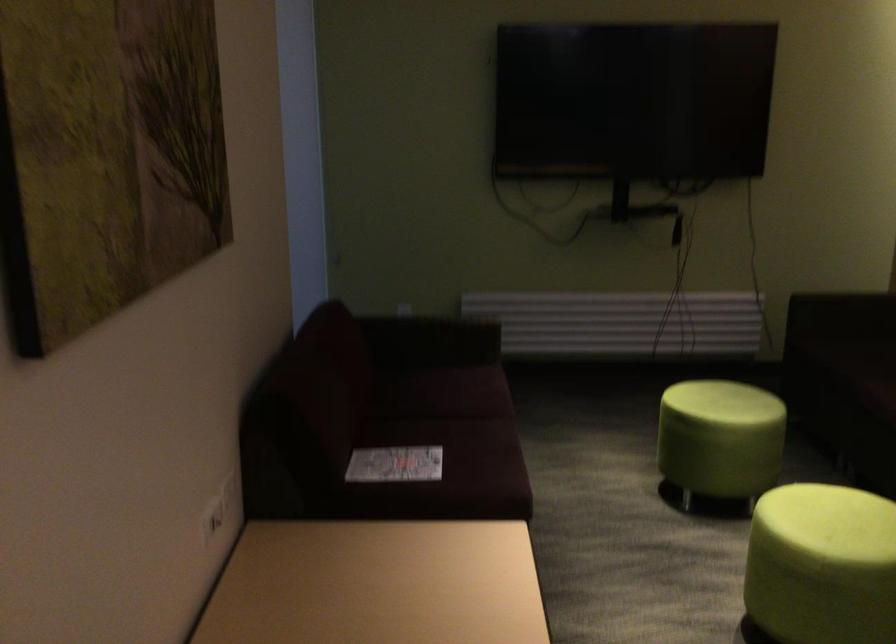
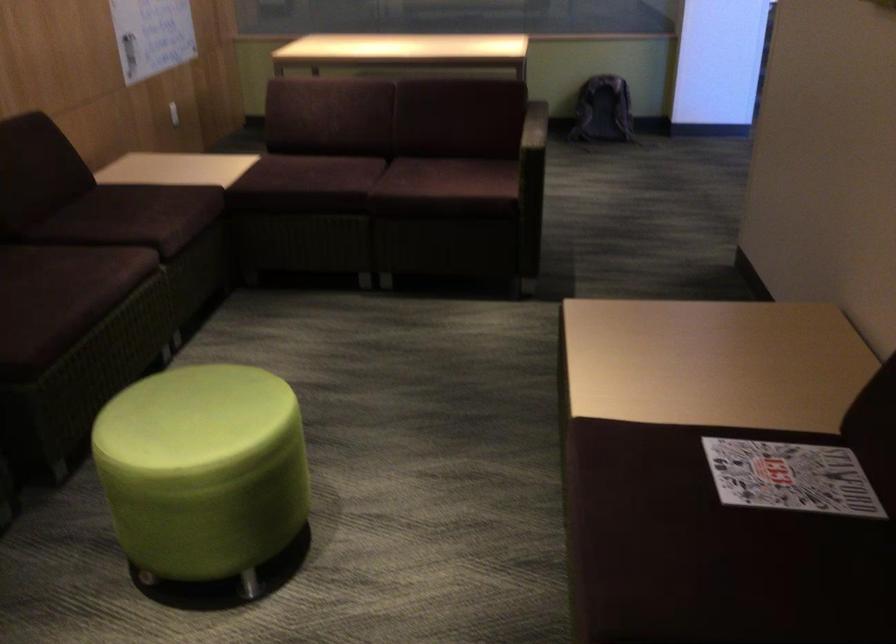
The point at [789,498] is marked in the first image. Where is the corresponding point in the second image?

(203, 471)